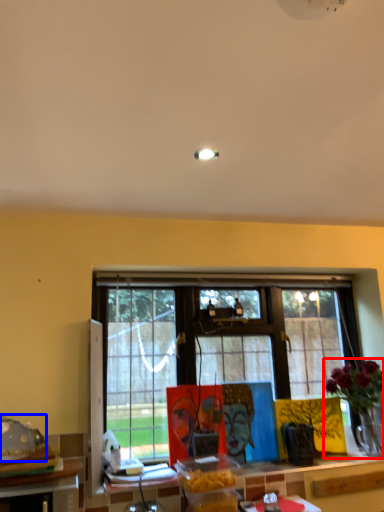
Question: Which point is further to the camera, houseplant (highlighted by a red box) or food (highlighted by a blue box)?

Choices:
 (A) houseplant
 (B) food

Answer: (A)